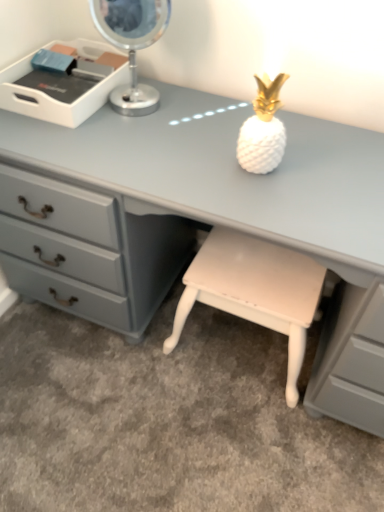
What are the coordinates of `free region under metallic silver table lamp at upper left (from a real-world perspective)` in the screenshot? It's located at (133, 112).